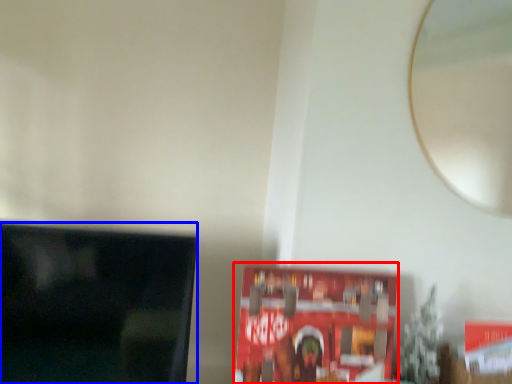
Question: Which object appears closest to the camera in this image, paperback book (highlighted by a red box) or television (highlighted by a blue box)?

Choices:
 (A) paperback book
 (B) television

Answer: (B)